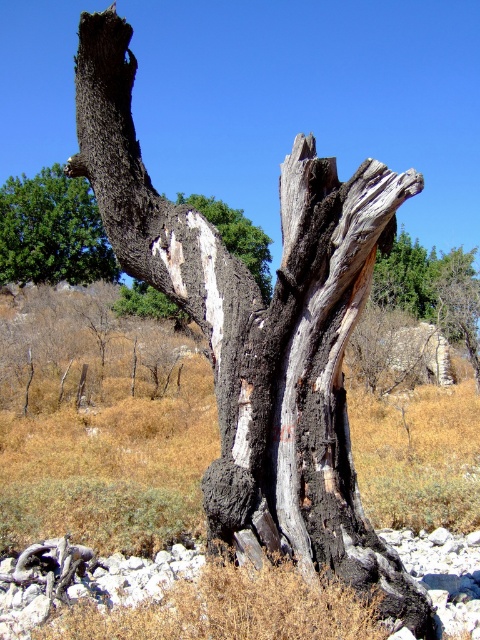
In the scene shown: Does green leafy tree at upper left have a lesser width compared to white textured bark at center?

In fact, green leafy tree at upper left might be wider than white textured bark at center.

Is green leafy tree at upper left bigger than white textured bark at center?

No.

Locate an element on the screen. The width and height of the screenshot is (480, 640). green leafy tree at upper left is located at coordinates (51, 230).